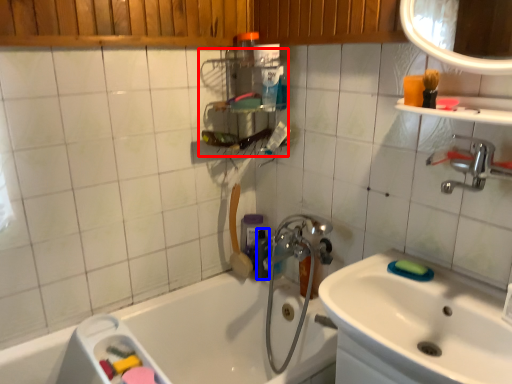
Question: Which point is closer to the camera, shelf (highlighted by a red box) or toiletry (highlighted by a blue box)?

Choices:
 (A) shelf
 (B) toiletry

Answer: (A)